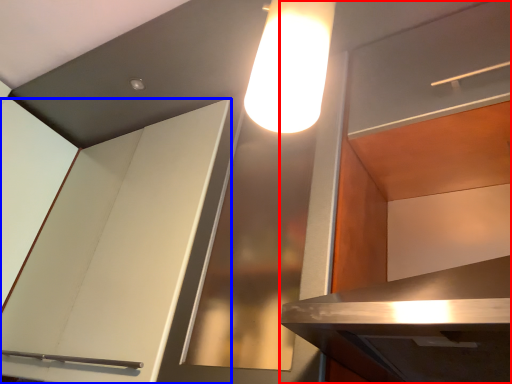
Question: Which object appears farthest to the camera in this image, cabinetry (highlighted by a red box) or cabinetry (highlighted by a blue box)?

Choices:
 (A) cabinetry
 (B) cabinetry

Answer: (B)